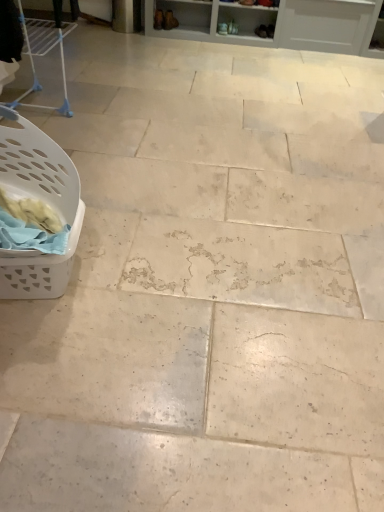
Question: Would you say white plastic laundry basket at left is a long distance from matte brown boot at upper center, the second footwear when ordered from right to left?

Choices:
 (A) yes
 (B) no

Answer: (A)

Question: Is white plastic laundry basket at left positioned beyond the bounds of matte brown boot at upper center, the second footwear when ordered from right to left?

Choices:
 (A) no
 (B) yes

Answer: (B)

Question: Is white plastic laundry basket at left with matte brown boot at upper center, acting as the first footwear starting from the left?

Choices:
 (A) no
 (B) yes

Answer: (A)

Question: Does white plastic laundry basket at left have a greater width compared to matte brown boot at upper center, acting as the first footwear starting from the left?

Choices:
 (A) no
 (B) yes

Answer: (B)

Question: Is white plastic laundry basket at left taller than matte brown boot at upper center, acting as the first footwear starting from the left?

Choices:
 (A) yes
 (B) no

Answer: (A)

Question: Considering the positions of white plastic laundry basket at left and matte brown boot at upper center, acting as the first footwear starting from the left, in the image, is white plastic laundry basket at left taller or shorter than matte brown boot at upper center, acting as the first footwear starting from the left,?

Choices:
 (A) short
 (B) tall

Answer: (B)

Question: Is white plastic laundry basket at left spatially inside matte brown boot at upper center, the second footwear when ordered from right to left, or outside of it?

Choices:
 (A) outside
 (B) inside

Answer: (A)

Question: From a real-world perspective, is white plastic laundry basket at left above or below matte brown boot at upper center, acting as the first footwear starting from the left?

Choices:
 (A) below
 (B) above

Answer: (B)

Question: Is point (46, 139) positioned closer to the camera than point (170, 20)?

Choices:
 (A) closer
 (B) farther

Answer: (A)

Question: Based on their sizes in the image, would you say matte brown boot at upper center, the second footwear when ordered from right to left, is bigger or smaller than matte brown shoe at upper center, the 1th footwear viewed from the right?

Choices:
 (A) small
 (B) big

Answer: (B)

Question: Based on their positions, is matte brown boot at upper center, the second footwear when ordered from right to left, located to the left or right of matte brown shoe at upper center, the 1th footwear viewed from the right?

Choices:
 (A) left
 (B) right

Answer: (A)

Question: Is point (172, 19) closer or farther from the camera than point (259, 28)?

Choices:
 (A) farther
 (B) closer

Answer: (B)

Question: In terms of width, does matte brown boot at upper center, acting as the first footwear starting from the left, look wider or thinner when compared to matte brown shoe at upper center, the 1th footwear viewed from the right?

Choices:
 (A) wide
 (B) thin

Answer: (A)

Question: Is matte brown boot at upper center, acting as the first footwear starting from the left, taller or shorter than white plastic laundry basket at left?

Choices:
 (A) short
 (B) tall

Answer: (A)

Question: From the image's perspective, relative to white plastic laundry basket at left, is matte brown boot at upper center, acting as the first footwear starting from the left, above or below?

Choices:
 (A) above
 (B) below

Answer: (A)